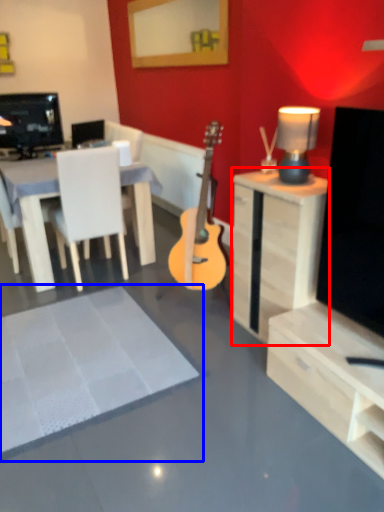
Question: Among these objects, which one is nearest to the camera, desk (highlighted by a red box) or flat (highlighted by a blue box)?

Choices:
 (A) desk
 (B) flat

Answer: (B)